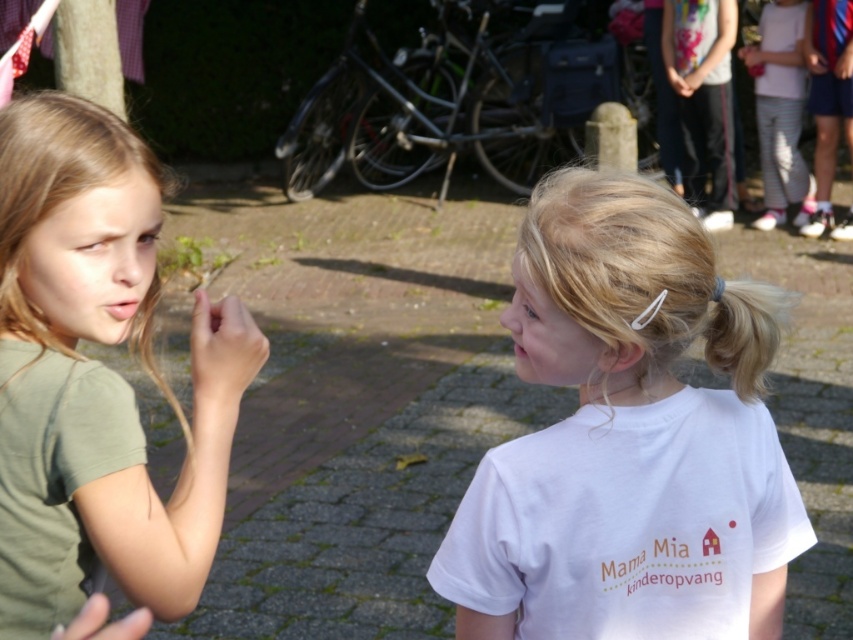
You are a photographer trying to capture a group photo of the two girls. You notice the matte green shirt at left and the white striped pants at upper right. Which clothing item appears narrower when viewed from your current position?

The matte green shirt at left appears narrower than the white striped pants at upper right because it has a lesser width compared to the white striped pants at upper right.